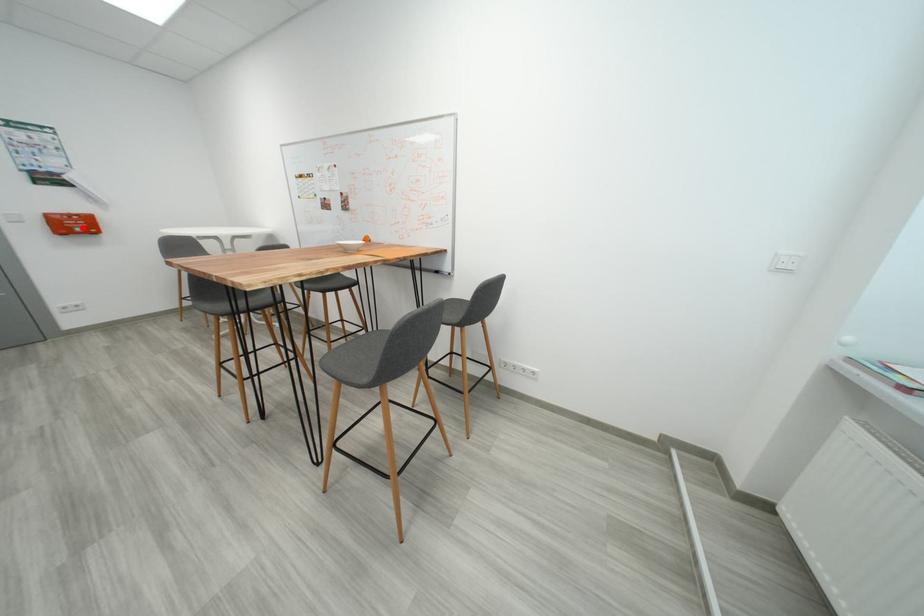
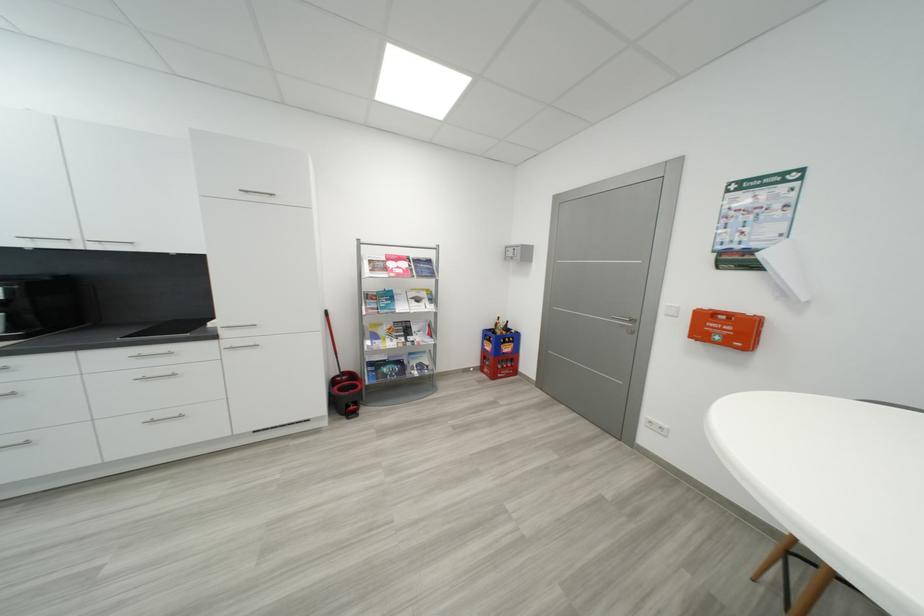
In the second image, find the point that corresponds to the highlighted location in the first image.

(733, 333)